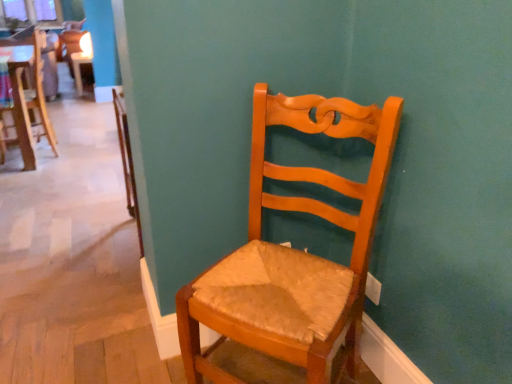
Question: Does wooden chair at center, the first chair viewed from the left, have a smaller size compared to wooden chair with woven seat cushion at center, arranged as the first chair when ordered from the bottom?

Choices:
 (A) yes
 (B) no

Answer: (A)

Question: From the image's perspective, is wooden chair at center, the first chair viewed from the left, below wooden chair with woven seat cushion at center, the third chair positioned from the left?

Choices:
 (A) no
 (B) yes

Answer: (A)

Question: From a real-world perspective, is wooden chair at center, the first chair from the top, over wooden chair with woven seat cushion at center, which ranks as the first chair in front-to-back order?

Choices:
 (A) yes
 (B) no

Answer: (B)

Question: Does wooden chair at center, placed as the 1th chair when sorted from back to front, have a lesser height compared to wooden chair with woven seat cushion at center, which ranks as the first chair in front-to-back order?

Choices:
 (A) yes
 (B) no

Answer: (A)

Question: Is wooden chair at center, the first chair viewed from the left, outside wooden chair with woven seat cushion at center, positioned as the 1th chair in right-to-left order?

Choices:
 (A) yes
 (B) no

Answer: (A)

Question: Is wooden chair at center, marked as the third chair in a front-to-back arrangement, oriented towards wooden chair with woven seat cushion at center, positioned as the 1th chair in right-to-left order?

Choices:
 (A) yes
 (B) no

Answer: (B)

Question: From a real-world perspective, does wooden chair at center, the second chair positioned from the right, stand above wooden chair at center, the 3th chair viewed from the right?

Choices:
 (A) yes
 (B) no

Answer: (A)

Question: Is wooden chair at center, the second chair positioned from the right, bigger than wooden chair at center, the first chair viewed from the left?

Choices:
 (A) yes
 (B) no

Answer: (A)

Question: Is wooden chair at center, the 2th chair viewed from the front, directly adjacent to wooden chair at center, placed as the 1th chair when sorted from back to front?

Choices:
 (A) no
 (B) yes

Answer: (A)

Question: Is wooden chair at center, the second chair positioned from the right, thinner than wooden chair at center, the first chair from the top?

Choices:
 (A) yes
 (B) no

Answer: (B)

Question: Is wooden chair at center, the second chair positioned from the right, turned away from wooden chair at center, the 3th chair when ordered from bottom to top?

Choices:
 (A) no
 (B) yes

Answer: (A)

Question: From the image's perspective, is wooden chair at center, the 2th chair viewed from the front, below wooden chair at center, the first chair from the top?

Choices:
 (A) yes
 (B) no

Answer: (A)

Question: Does wooden chair at center, the 3th chair viewed from the right, touch wooden chair at center, the second chair positioned from the right?

Choices:
 (A) yes
 (B) no

Answer: (B)